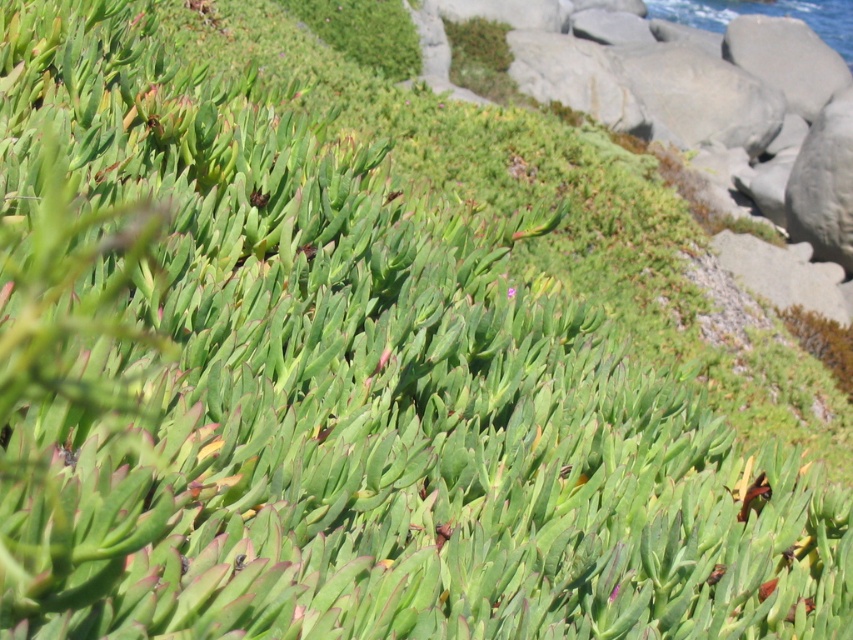
You are standing in the coastal landscape and want to find the blue water at upper right. Which direction should you look relative to the green succulent at center?

The blue water at upper right is above the green succulent at center, so you should look upward from the green succulent at center to find it.

You are standing in the coastal landscape and want to reach the blue water at upper right from the green succulent at center. Which direction should you move to get there?

To reach the blue water at upper right from the green succulent at center, you should move to the right since the blue water at upper right is located to the right of the green succulent at center.